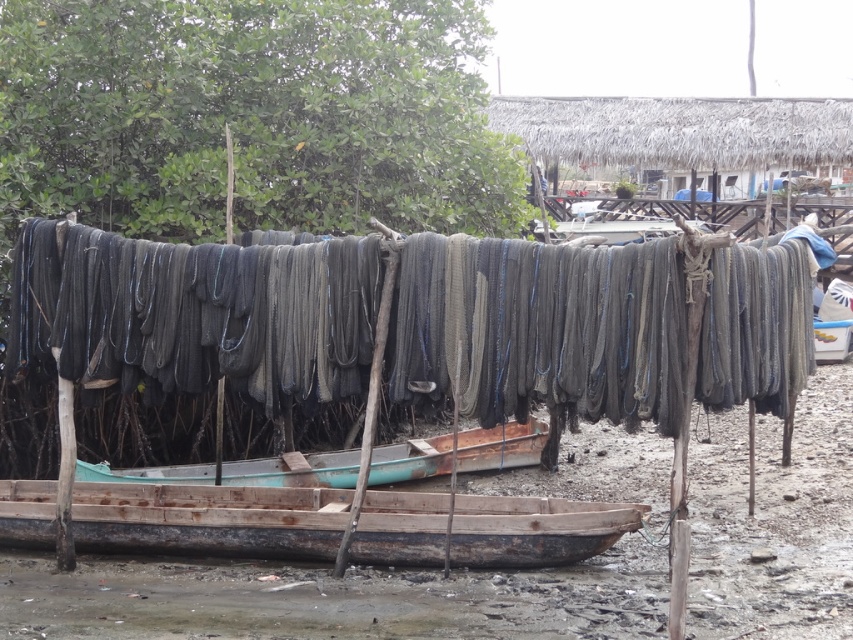
You need to transport a large crate that is 2 meters wide. You have to pass through the area between the dark gray netting at center and the rusty wooden boat at center. Can the crate fit through the space between them?

The dark gray netting at center is wider than the rusty wooden boat at center. Since the crate is 2 meters wide, it might fit through the space between them, but the exact width of the gap isn

You are a fisherman who needs to retrieve your rusty wooden boat at center from under the dark gray netting at center. Can you lift the boat without moving the netting?

The dark gray netting at center is located above the rusty wooden boat at center, so you can lift the boat without moving the netting since the netting is positioned higher up and not obstructing the boat directly below.

You are standing in the fishing village scene and want to place a small marker at one of the two points, point (189, 346) or point (403, 460). Which point is closer to you?

Point (189, 346) is closer to the viewer than point (403, 460), so you should place the marker there.